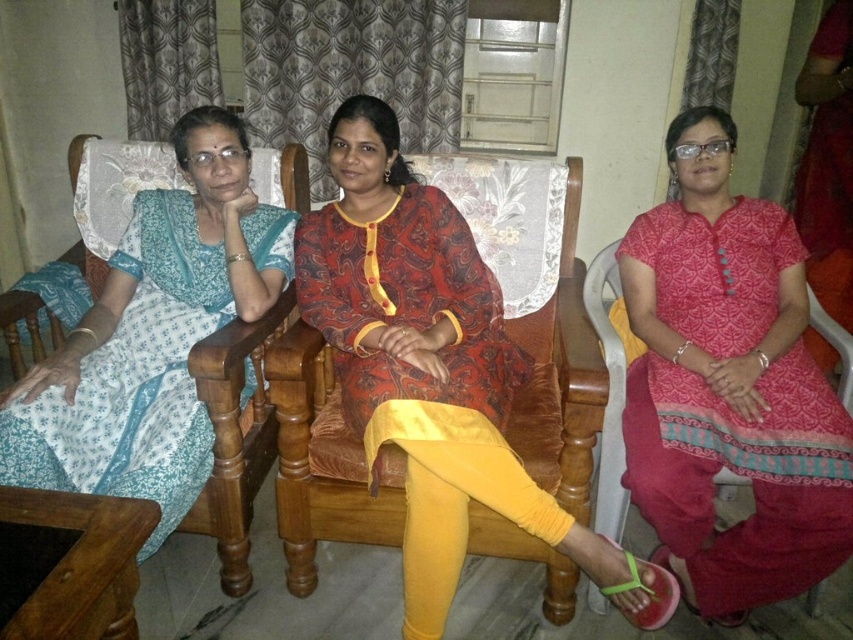
Question: Which of the following is the closest to the observer?

Choices:
 (A) matte red dress at center
 (B) light blue printed dress at left
 (C) matte pink dress at center

Answer: (A)

Question: Considering the relative positions of matte pink dress at center and light blue printed dress at left in the image provided, where is matte pink dress at center located with respect to light blue printed dress at left?

Choices:
 (A) below
 (B) above

Answer: (A)

Question: Which is farther from the matte red dress at center?

Choices:
 (A) matte pink dress at center
 (B) light blue printed dress at left

Answer: (A)

Question: Is matte red dress at center below light blue printed dress at left?

Choices:
 (A) no
 (B) yes

Answer: (B)

Question: Is the position of matte red dress at center more distant than that of light blue printed dress at left?

Choices:
 (A) yes
 (B) no

Answer: (B)

Question: Which of the following is the closest to the observer?

Choices:
 (A) (369, 141)
 (B) (142, 269)
 (C) (677, 339)

Answer: (A)